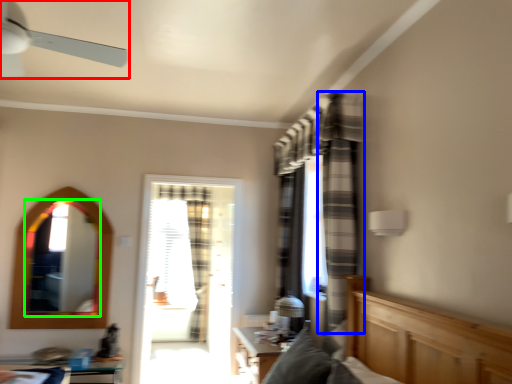
Question: Which object is the closest to the ceiling fan (highlighted by a red box)? Choose among these: curtain (highlighted by a blue box) or mirror (highlighted by a green box).

Choices:
 (A) curtain
 (B) mirror

Answer: (A)